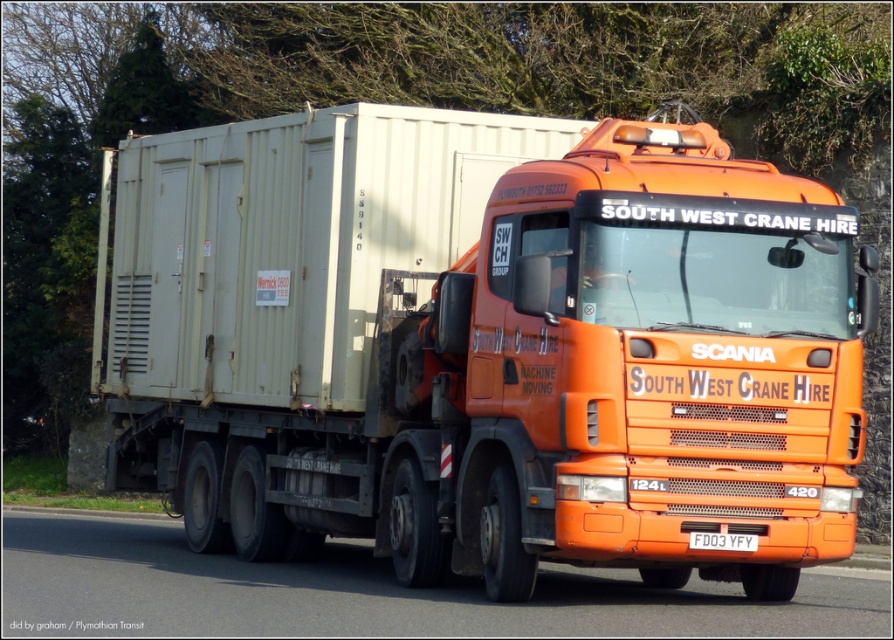
Can you confirm if orange matte truck at center is positioned below orange glossy truck at center?

Actually, orange matte truck at center is above orange glossy truck at center.

Is orange matte truck at center closer to camera compared to orange glossy truck at center?

No, it is behind orange glossy truck at center.

This screenshot has width=894, height=640. In order to click on orange matte truck at center in this screenshot , I will do `click(485, 344)`.

This screenshot has width=894, height=640. Find the location of `orange matte truck at center`. orange matte truck at center is located at coordinates (485, 344).

Between orange matte truck at center and white plastic license plate at center, which one has less height?

white plastic license plate at center

What do you see at coordinates (485, 344) in the screenshot?
I see `orange matte truck at center` at bounding box center [485, 344].

Who is more forward, (209, 444) or (706, 544)?

Point (706, 544)

Find the location of a particular element. The height and width of the screenshot is (640, 894). orange matte truck at center is located at coordinates (485, 344).

Between point (264, 582) and point (710, 545), which one is positioned behind?

Point (264, 582)

Does point (572, 572) come closer to viewer compared to point (748, 541)?

No, it is behind (748, 541).

The height and width of the screenshot is (640, 894). Find the location of `orange glossy truck at center`. orange glossy truck at center is located at coordinates (x=370, y=593).